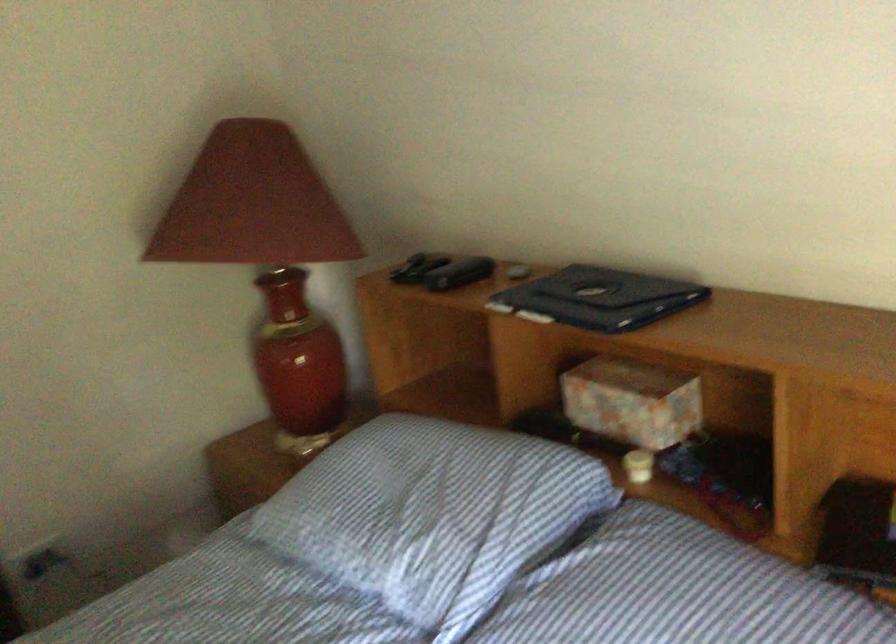
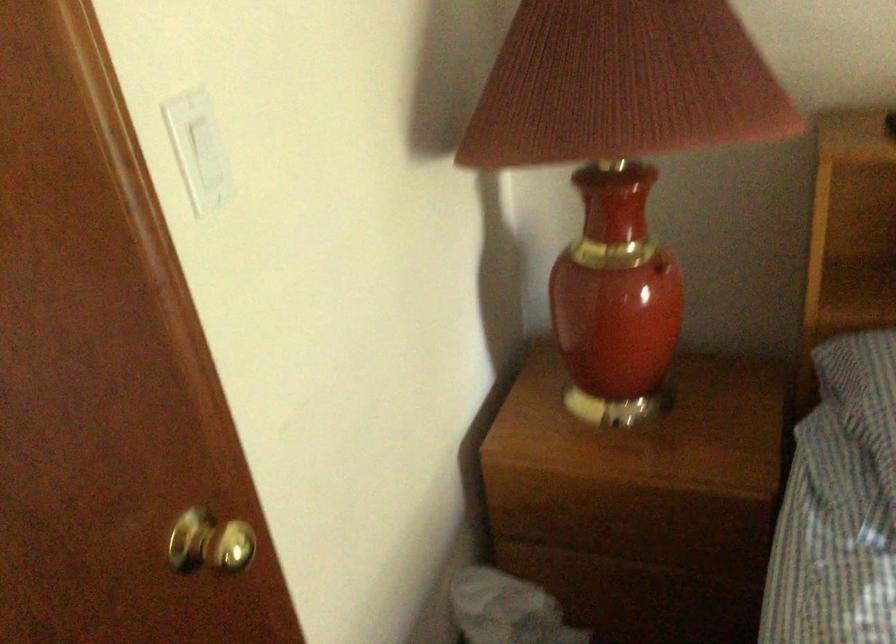
Locate, in the second image, the point that corresponds to (294,328) in the first image.

(661, 267)